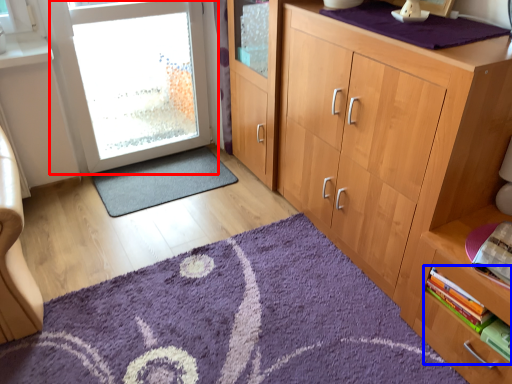
Question: Which point is closer to the camera, door (highlighted by a red box) or book (highlighted by a blue box)?

Choices:
 (A) door
 (B) book

Answer: (B)